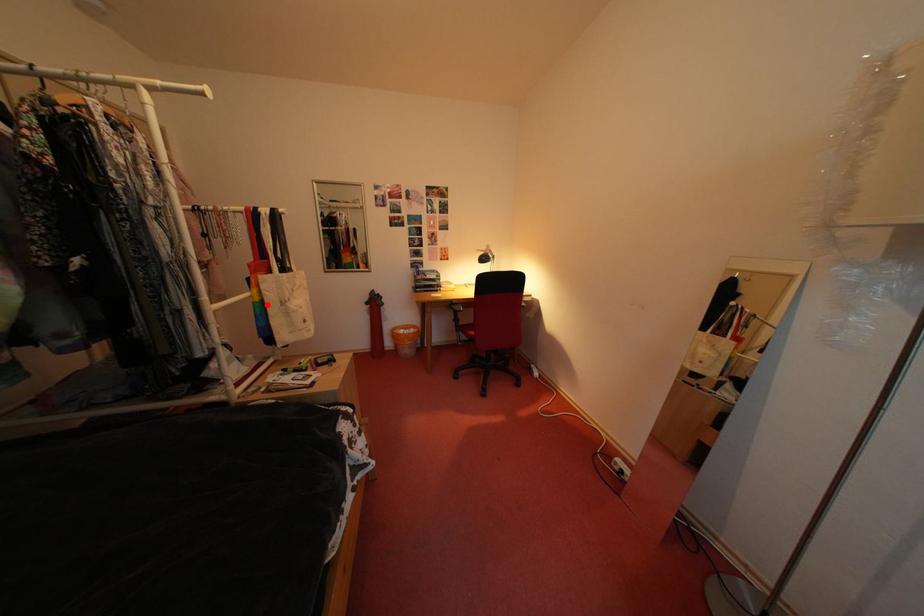
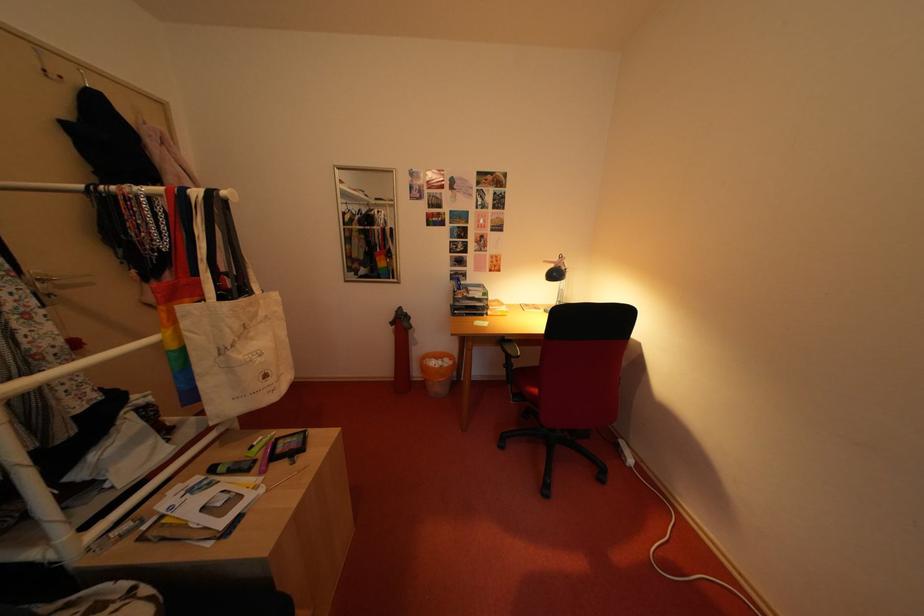
Question: I am providing you with two images of the same scene from different viewpoints. A red point is marked on the first image. Is the red point's position out of view in image 2?

Choices:
 (A) Yes
 (B) No

Answer: (B)